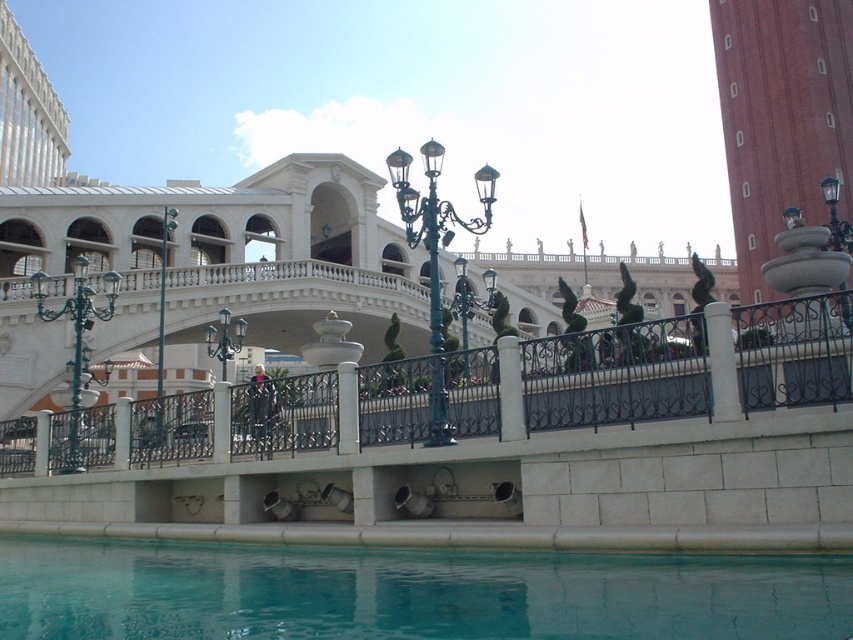
Question: Estimate the real-world distances between objects in this image. Which object is closer to the teal glossy water at lower center?

Choices:
 (A) polished brass chandelier at center
 (B) green metal lamp post at left

Answer: (B)

Question: Which of these objects is positioned farthest from the polished brass chandelier at center?

Choices:
 (A) black metal lamp post at upper right
 (B) green wrought iron streetlight at center
 (C) green metal lamp post at left

Answer: (A)

Question: Among these points, which one is farthest from the camera?

Choices:
 (A) (436, 253)
 (B) (73, 266)
 (C) (827, 240)

Answer: (B)

Question: Can you confirm if green wrought iron streetlight at center is positioned below polished brass chandelier at center?

Choices:
 (A) no
 (B) yes

Answer: (A)

Question: Can you confirm if green wrought iron streetlight at center is positioned to the left of polished brass streetlight at center?

Choices:
 (A) no
 (B) yes

Answer: (B)

Question: Can you confirm if teal glossy water at lower center is thinner than green wrought iron streetlight at center?

Choices:
 (A) no
 (B) yes

Answer: (A)